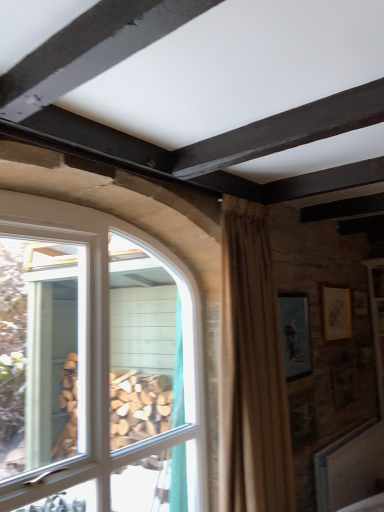
Question: Is white glass window at left located outside beige textured curtain at center?

Choices:
 (A) yes
 (B) no

Answer: (A)

Question: Is white glass window at left smaller than beige textured curtain at center?

Choices:
 (A) no
 (B) yes

Answer: (A)

Question: Is white glass window at left looking in the opposite direction of beige textured curtain at center?

Choices:
 (A) no
 (B) yes

Answer: (A)

Question: Does white glass window at left have a lesser height compared to beige textured curtain at center?

Choices:
 (A) yes
 (B) no

Answer: (B)

Question: From a real-world perspective, is white glass window at left physically below beige textured curtain at center?

Choices:
 (A) yes
 (B) no

Answer: (A)

Question: From a real-world perspective, is white glass window at left on beige textured curtain at center?

Choices:
 (A) yes
 (B) no

Answer: (B)

Question: Is the surface of matte gold picture frame at upper right, arranged as the 2th picture frame when viewed from the front, in direct contact with white glass window at left?

Choices:
 (A) no
 (B) yes

Answer: (A)

Question: Is matte gold picture frame at upper right, marked as the 1th picture frame in a back-to-front arrangement, looking in the opposite direction of white glass window at left?

Choices:
 (A) no
 (B) yes

Answer: (A)

Question: Does matte gold picture frame at upper right, which ranks as the second picture frame in left-to-right order, come in front of white glass window at left?

Choices:
 (A) no
 (B) yes

Answer: (A)

Question: Does matte gold picture frame at upper right, which ranks as the second picture frame in left-to-right order, have a lesser width compared to white glass window at left?

Choices:
 (A) yes
 (B) no

Answer: (A)

Question: Are matte gold picture frame at upper right, which ranks as the second picture frame in left-to-right order, and white glass window at left far apart?

Choices:
 (A) no
 (B) yes

Answer: (B)

Question: Considering the relative sizes of matte gold picture frame at upper right, arranged as the 2th picture frame when viewed from the front, and white glass window at left in the image provided, is matte gold picture frame at upper right, arranged as the 2th picture frame when viewed from the front, bigger than white glass window at left?

Choices:
 (A) no
 (B) yes

Answer: (A)

Question: Can we say beige textured curtain at center lies outside white glass window at left?

Choices:
 (A) yes
 (B) no

Answer: (A)